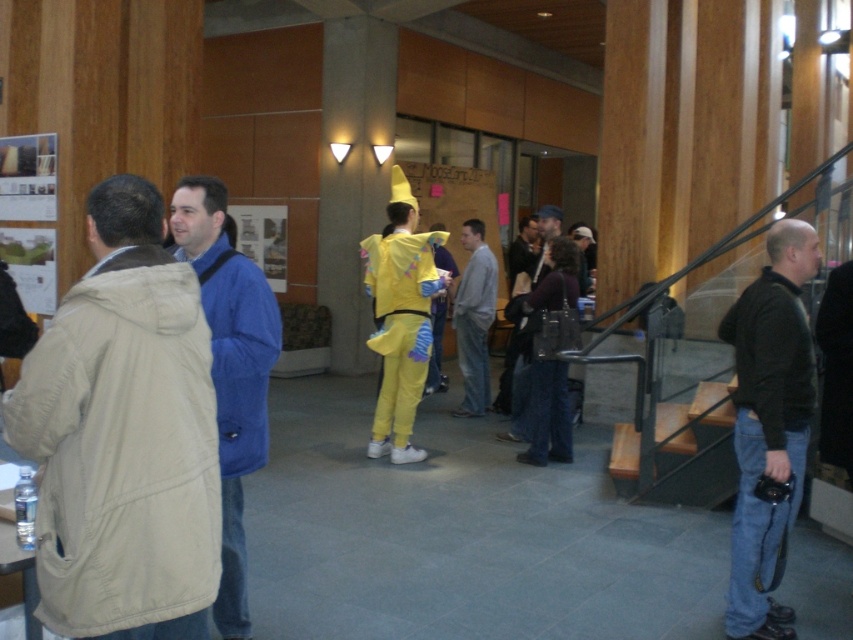
Question: Which object is farther from the camera taking this photo?

Choices:
 (A) beige fabric jacket at left
 (B) gray cotton sweatshirt at center
 (C) dark gray sweater at right
 (D) wooden at right

Answer: (B)

Question: Which of the following is the farthest from the observer?

Choices:
 (A) gray cotton sweatshirt at center
 (B) dark gray sweater at right
 (C) wooden at right
 (D) beige fabric jacket at left

Answer: (A)

Question: Can you confirm if beige fabric jacket at left is positioned to the right of blue fabric jacket at center?

Choices:
 (A) no
 (B) yes

Answer: (B)

Question: Does dark gray sweater at right appear on the right side of wooden at right?

Choices:
 (A) no
 (B) yes

Answer: (A)

Question: Which of the following is the closest to the observer?

Choices:
 (A) gray cotton sweatshirt at center
 (B) blue fabric jacket at center

Answer: (B)

Question: Is beige fabric jacket at left smaller than blue fabric jacket at center?

Choices:
 (A) yes
 (B) no

Answer: (A)